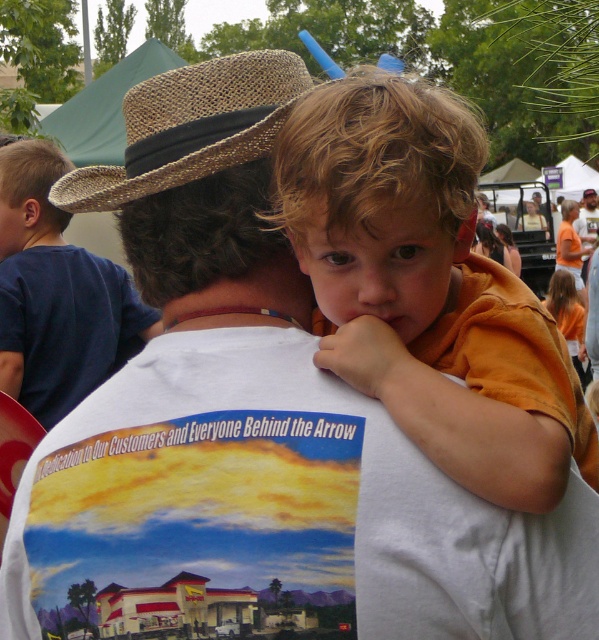
Question: Estimate the real-world distances between objects in this image. Which object is farther from the brown woven cowboy hat at upper center?

Choices:
 (A) blue cotton shirt at upper center
 (B) orange cotton shirt at upper center

Answer: (A)

Question: Does blue cotton shirt at upper center have a greater width compared to brown woven cowboy hat at upper center?

Choices:
 (A) no
 (B) yes

Answer: (B)

Question: Does orange cotton shirt at upper center appear under brown woven cowboy hat at upper center?

Choices:
 (A) no
 (B) yes

Answer: (B)

Question: Can you confirm if orange cotton shirt at upper center is positioned to the right of brown woven cowboy hat at upper center?

Choices:
 (A) no
 (B) yes

Answer: (B)

Question: Which object is positioned farthest from the brown woven cowboy hat at upper center?

Choices:
 (A) blue cotton shirt at upper center
 (B) orange cotton shirt at upper center

Answer: (A)

Question: Among these objects, which one is farthest from the camera?

Choices:
 (A) brown woven cowboy hat at upper center
 (B) blue cotton shirt at upper center
 (C) orange cotton shirt at upper center

Answer: (B)